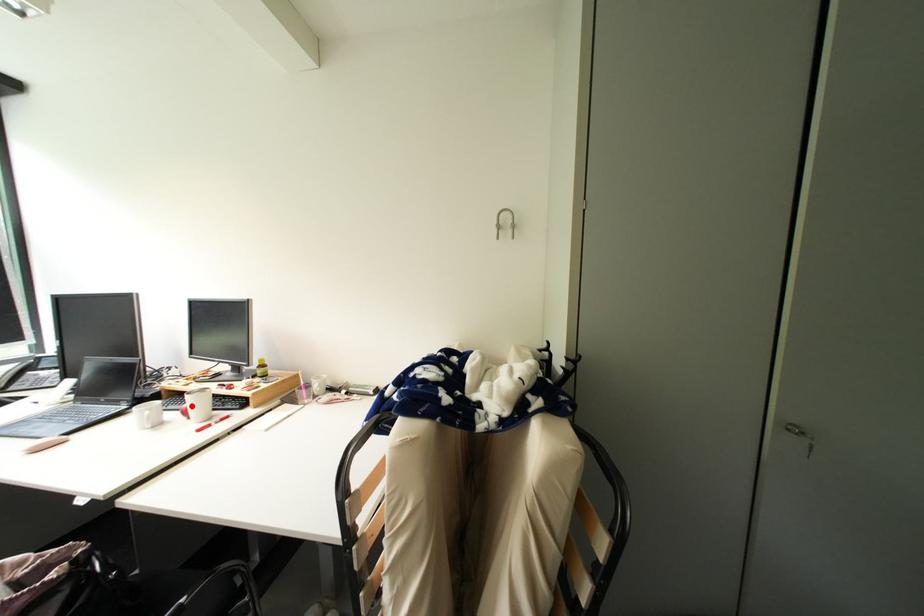
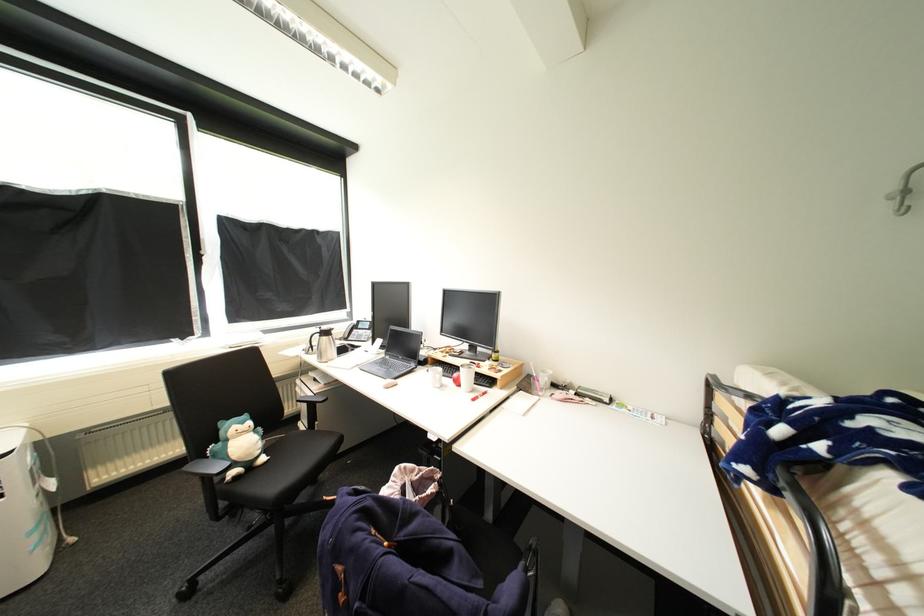
Find the pixel in the second image that matches the highlighted location in the first image.

(462, 376)